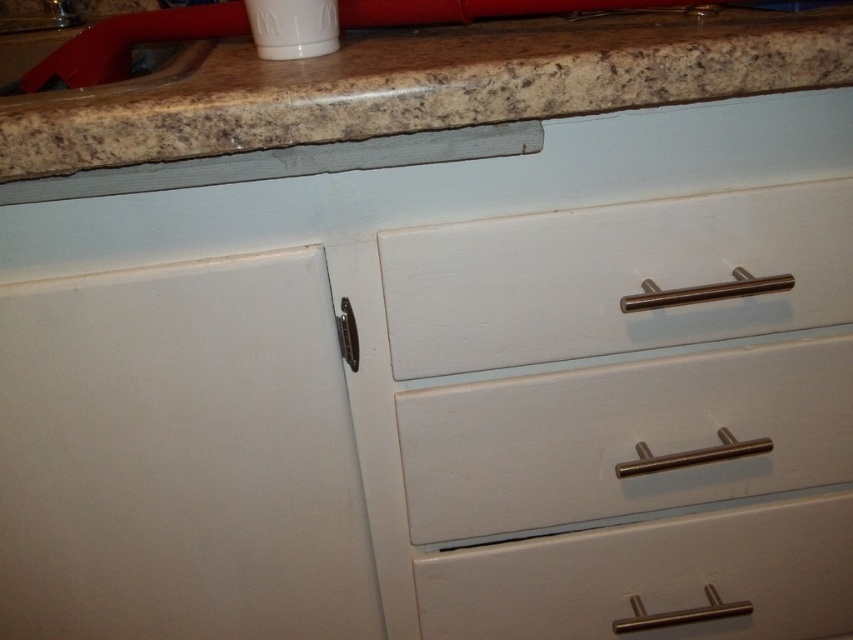
Is white matte drawer at center thinner than matte white drawer at center?

Correct, white matte drawer at center's width is less than matte white drawer at center's.

Is white matte drawer at center positioned at the back of matte white drawer at center?

That is False.

Who is more distant from viewer, (846, 358) or (450, 611)?

The point (450, 611) is more distant.

Where is `white matte drawer at center`? This screenshot has width=853, height=640. white matte drawer at center is located at coordinates (622, 436).

Between brown granite countertop at upper center and white painted wood drawer at center, which one is positioned higher?

Positioned higher is brown granite countertop at upper center.

The height and width of the screenshot is (640, 853). I want to click on brown granite countertop at upper center, so click(421, 84).

Where is `brown granite countertop at upper center`? brown granite countertop at upper center is located at coordinates (421, 84).

Does matte white drawer at center have a lesser height compared to brushed metal sink at upper left?

Correct, matte white drawer at center is not as tall as brushed metal sink at upper left.

You are a GUI agent. You are given a task and a screenshot of the screen. Output one action in this format:
    pyautogui.click(x=<x>, y=<y>)
    Task: Click on the matte white drawer at center
    The image size is (853, 640).
    Given the screenshot: What is the action you would take?
    pyautogui.click(x=653, y=579)

Is point (657, 532) positioned behind point (22, 60)?

No, it is in front of (22, 60).

Find the location of a particular element. matte white drawer at center is located at coordinates (653, 579).